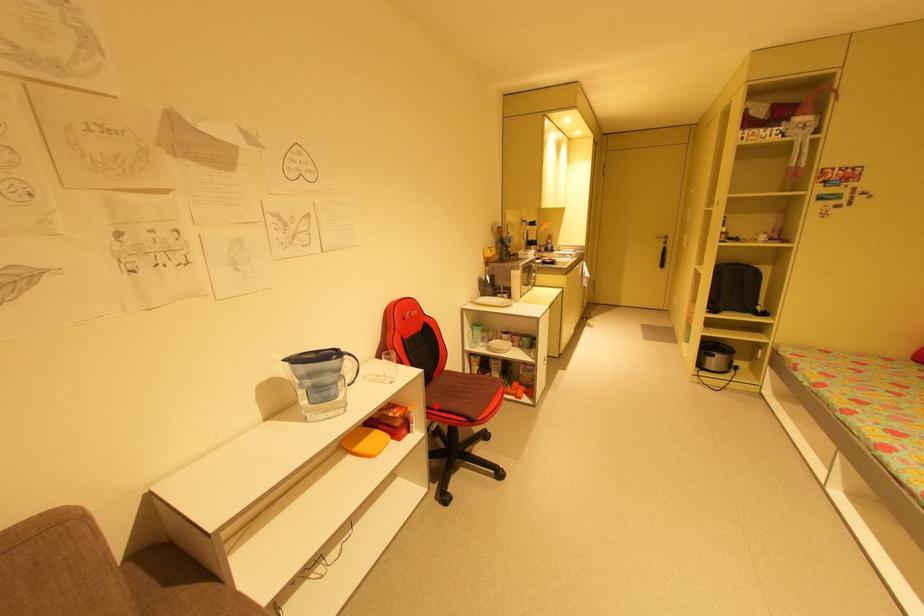
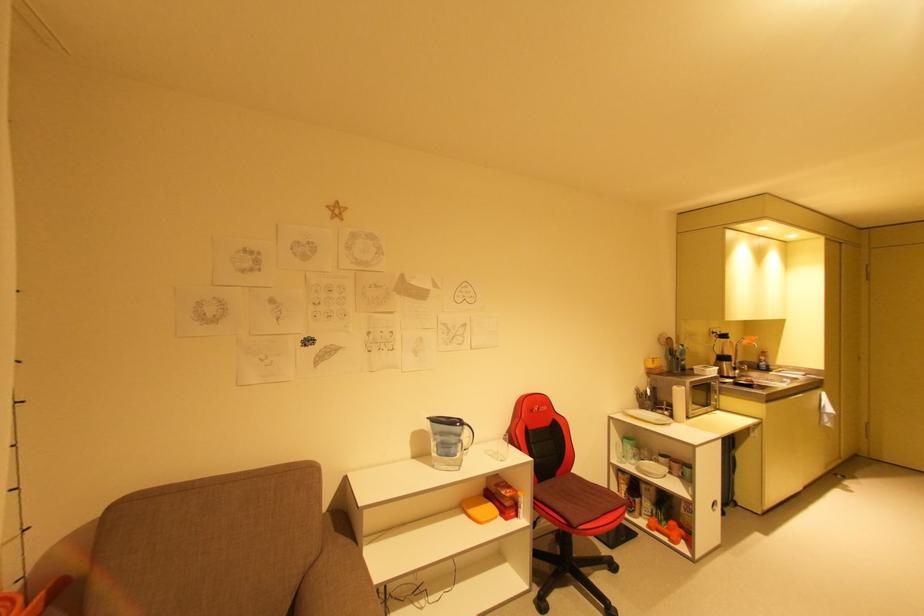
Question: I am providing you with two images of the same scene from different viewpoints. Given a red point in image1, look at the same physical point in image2. Is it:

Choices:
 (A) Closer to the viewpoint
 (B) Farther from the viewpoint

Answer: (B)